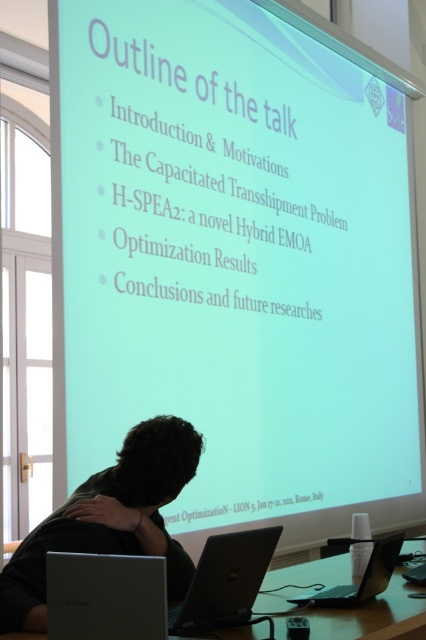
Which of these two, silver metallic laptop at lower center or black plastic laptop at lower center, stands taller?

silver metallic laptop at lower center

Is silver metallic laptop at lower center to the right of black plastic laptop at lower center from the viewer's perspective?

In fact, silver metallic laptop at lower center is to the left of black plastic laptop at lower center.

Who is more forward, (201, 630) or (396, 536)?

Point (201, 630) is more forward.

The image size is (426, 640). In order to click on silver metallic laptop at lower center in this screenshot , I will do `click(224, 582)`.

You are a GUI agent. You are given a task and a screenshot of the screen. Output one action in this format:
    pyautogui.click(x=<x>, y=<y>)
    Task: Click on the white plastic table at lower center
    This screenshot has height=640, width=426.
    Given the screenshot: What is the action you would take?
    pyautogui.click(x=356, y=614)

Can you confirm if white plastic table at lower center is positioned to the right of black plastic laptop at lower center?

No, white plastic table at lower center is not to the right of black plastic laptop at lower center.

Is point (328, 620) in front of point (310, 595)?

Yes, point (328, 620) is in front of point (310, 595).

At what (x,y) coordinates should I click in order to perform the action: click on white plastic table at lower center. Please return your answer as a coordinate pair (x, y). Looking at the image, I should click on (356, 614).

Between black matte hair at lower left and black plastic laptop at lower center, which one is positioned higher?

black matte hair at lower left is above.

Is black matte hair at lower left thinner than black plastic laptop at lower center?

In fact, black matte hair at lower left might be wider than black plastic laptop at lower center.

What do you see at coordinates (109, 518) in the screenshot? I see `black matte hair at lower left` at bounding box center [109, 518].

Where is `black matte hair at lower left`? The height and width of the screenshot is (640, 426). black matte hair at lower left is located at coordinates (109, 518).